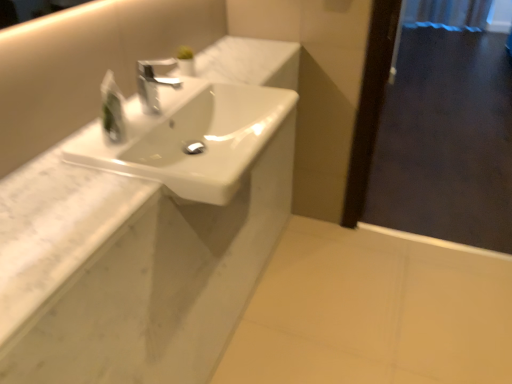
Where is `free space in front of satin nickel faucet at center`? This screenshot has width=512, height=384. free space in front of satin nickel faucet at center is located at coordinates (122, 132).